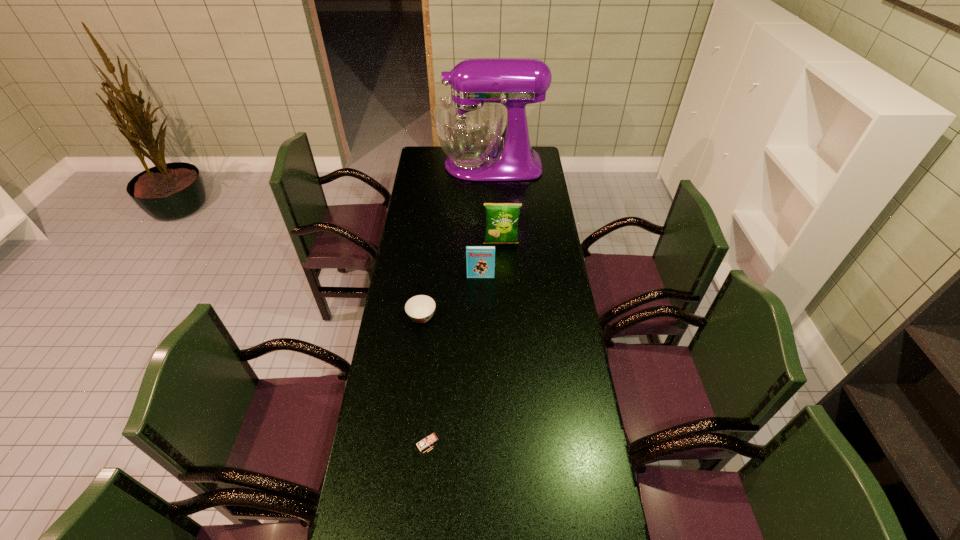
Locate an element on the screen. The height and width of the screenshot is (540, 960). free spot between the fourth farthest object and the fourth shortest object is located at coordinates (462, 280).

Where is `free space between the shortest object and the farthest object`? free space between the shortest object and the farthest object is located at coordinates (456, 241).

This screenshot has height=540, width=960. In order to click on object that is the fourth closest one to the book in this screenshot , I will do `click(427, 440)`.

Point out which object is positioned as the fourth nearest to the third shortest object. Please provide its 2D coordinates. Your answer should be formatted as a tuple, i.e. [(x, y)], where the tuple contains the x and y coordinates of a point satisfying the conditions above.

[(427, 440)]

This screenshot has width=960, height=540. Identify the location of vacant space that satisfies the following two spatial constraints: 1. at the bowl opening of the mixer; 2. on the front cover of the third tallest object. (492, 277).

This screenshot has width=960, height=540. What are the coordinates of `vacant region that satisfies the following two spatial constraints: 1. at the bowl opening of the tallest object; 2. on the front side of the fourth tallest object` in the screenshot? It's located at (497, 443).

Image resolution: width=960 pixels, height=540 pixels. Identify the location of vacant position in the image that satisfies the following two spatial constraints: 1. on the front side of the shortest object; 2. on the right side of the matchbox. (407, 443).